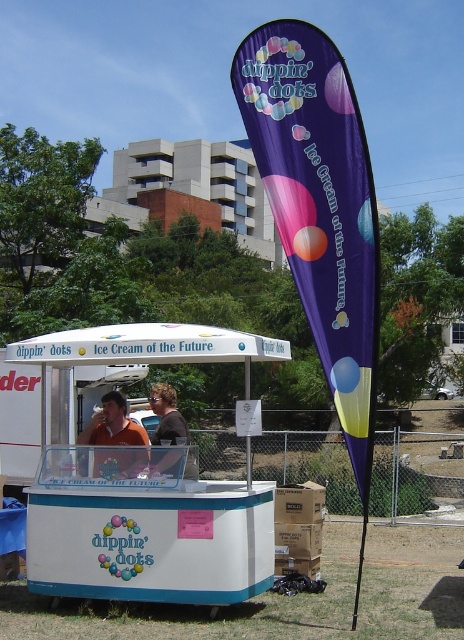
Question: Among these points, which one is nearest to the camera?

Choices:
 (A) (373, 312)
 (B) (123, 536)
 (C) (124, 417)

Answer: (A)

Question: Does white plastic food truck at center appear over purple fabric canopy at upper center?

Choices:
 (A) yes
 (B) no

Answer: (B)

Question: Does white plastic food truck at center appear on the right side of orange t-shirt at center?

Choices:
 (A) no
 (B) yes

Answer: (B)

Question: Estimate the real-world distances between objects in this image. Which object is farther from the purple fabric canopy at upper center?

Choices:
 (A) brown shirt at center
 (B) orange t-shirt at center
 (C) white plastic food truck at center

Answer: (B)

Question: Can you confirm if purple fabric canopy at upper center is positioned below orange t-shirt at center?

Choices:
 (A) yes
 (B) no

Answer: (B)

Question: Which is farther from the brown shirt at center?

Choices:
 (A) orange t-shirt at center
 (B) purple fabric canopy at upper center

Answer: (B)